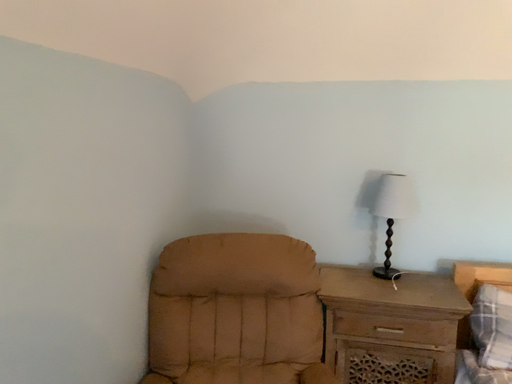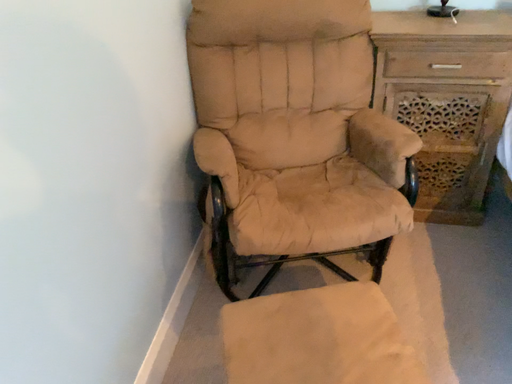
Question: How did the camera likely rotate when shooting the video?

Choices:
 (A) rotated upward
 (B) rotated downward

Answer: (B)